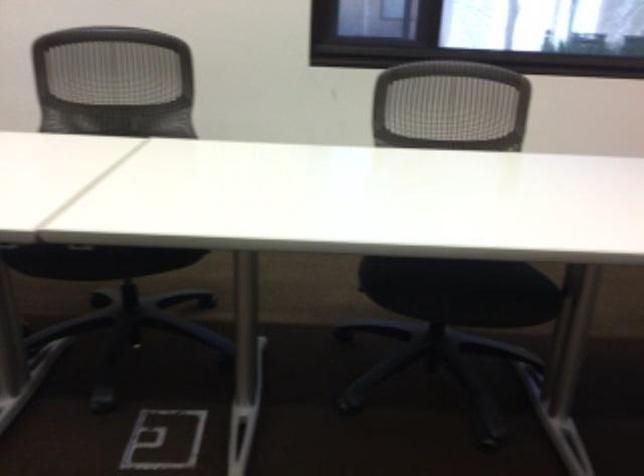
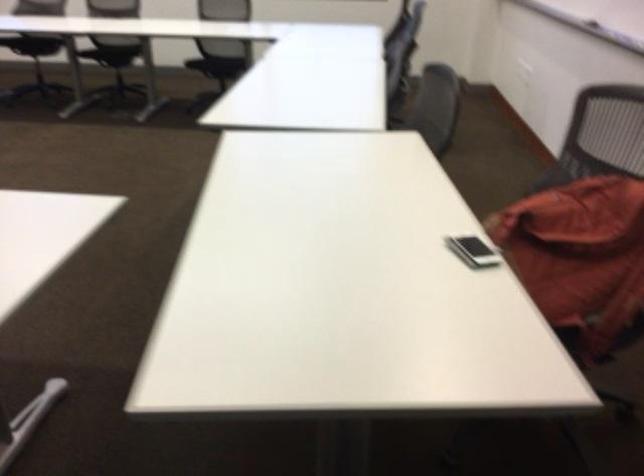
Which direction would the cameraman need to move to produce the second image?

The movement direction of the cameraman is right, backward.